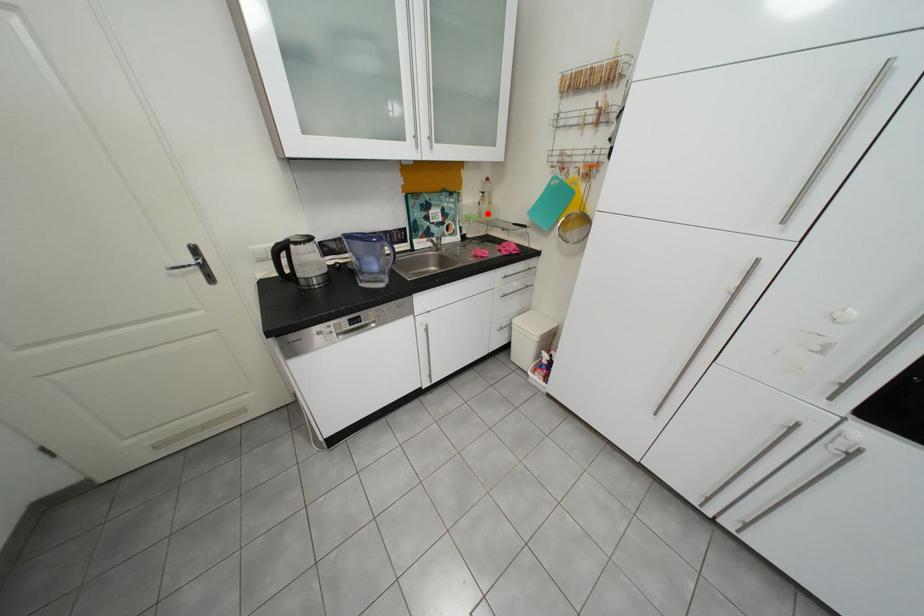
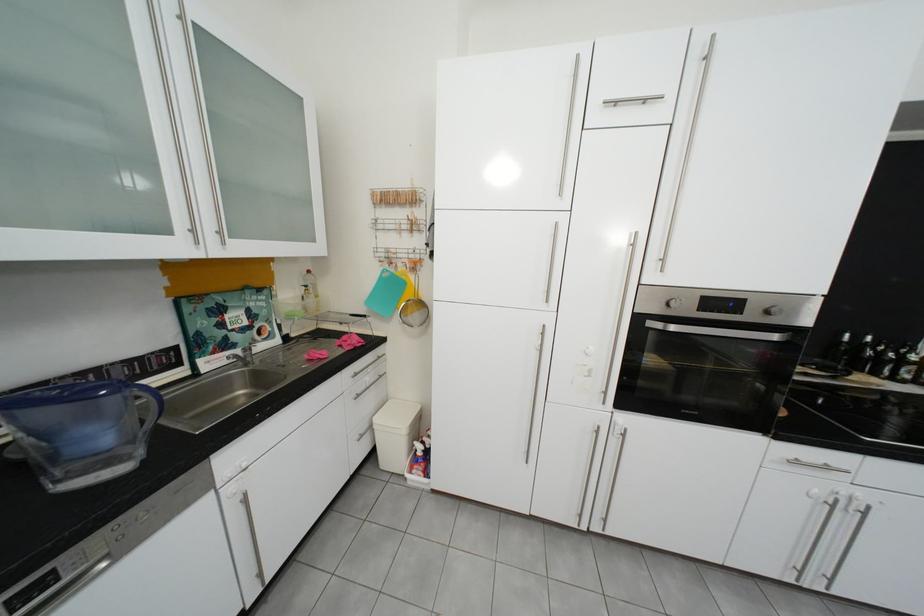
Question: A red point is marked in image1. In image2, is the corresponding 3D point closer to the camera or farther? Reply with the corresponding letter.

Choices:
 (A) The corresponding 3D point is closer.
 (B) The corresponding 3D point is farther.

Answer: (B)